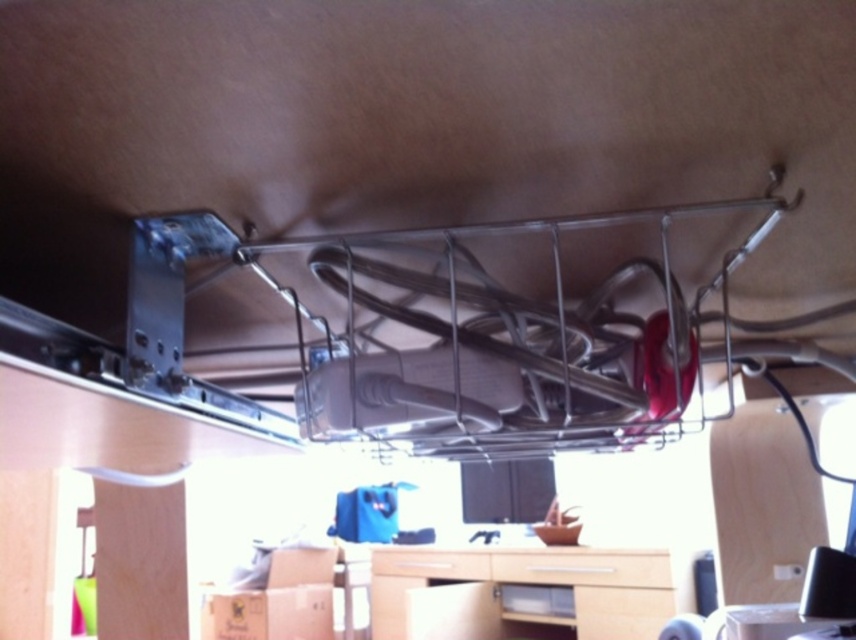
You are organizing items in a camper van and need to place a rectangular box that is 12 inches wide. You have two drawers available on the countertop at center. One is labeled as matte wood drawer at center and the other is wooden drawer at center. Which drawer should you choose to fit the box?

The matte wood drawer at center has a larger width than the wooden drawer at center, so the rectangular box that is 12 inches wide should be placed in the matte wood drawer at center.